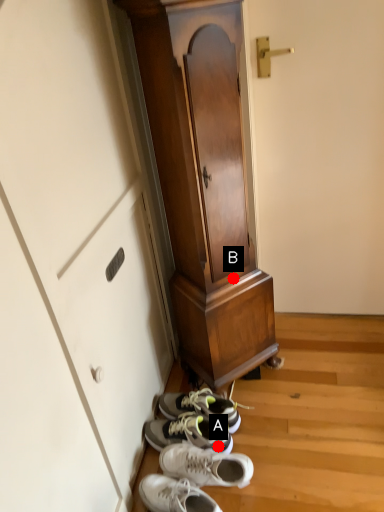
Question: Two points are circled on the image, labeled by A and B beside each circle. Which point is closer to the camera taking this photo?

Choices:
 (A) A is closer
 (B) B is closer

Answer: (A)